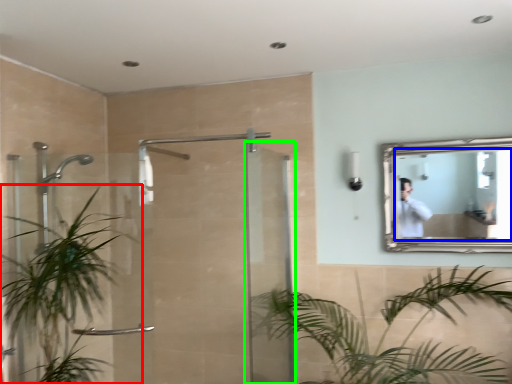
Question: Based on their relative distances, which object is farther from houseplant (highlighted by a red box)? Choose from mirror (highlighted by a blue box) and screen door (highlighted by a green box).

Choices:
 (A) mirror
 (B) screen door

Answer: (A)